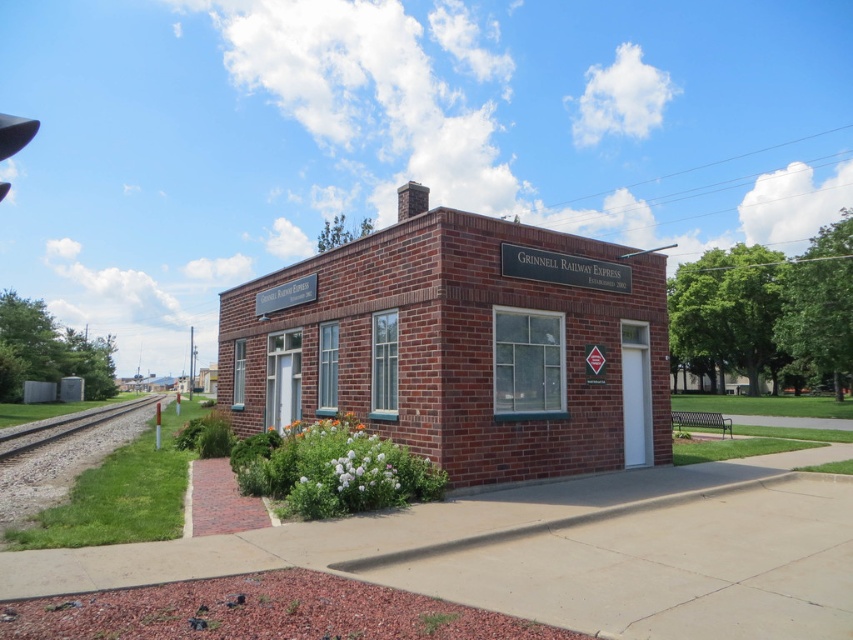
Question: Can you confirm if brick building at center is positioned to the right of gray gravel train track at lower left?

Choices:
 (A) yes
 (B) no

Answer: (A)

Question: Can you confirm if brick building at center is wider than gray gravel train track at lower left?

Choices:
 (A) no
 (B) yes

Answer: (A)

Question: Among these objects, which one is farthest from the camera?

Choices:
 (A) brick building at center
 (B) gray gravel train track at lower left

Answer: (B)

Question: Considering the relative positions of brick building at center and gray gravel train track at lower left in the image provided, where is brick building at center located with respect to gray gravel train track at lower left?

Choices:
 (A) above
 (B) below

Answer: (A)

Question: Which object appears farthest from the camera in this image?

Choices:
 (A) gray gravel train track at lower left
 (B) brick building at center

Answer: (A)